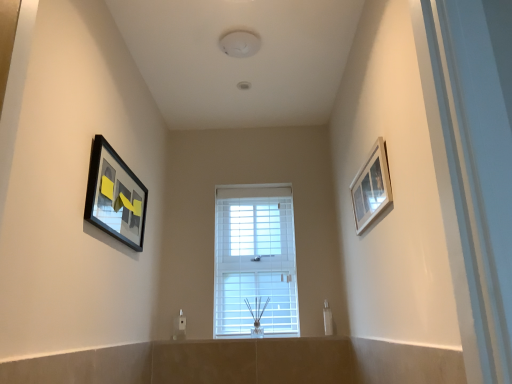
Question: Is point (359, 190) positioned closer to the camera than point (245, 284)?

Choices:
 (A) farther
 (B) closer

Answer: (B)

Question: Considering the positions of white glossy picture frame at upper right, the second picture frame when ordered from left to right, and white matte window at center in the image, is white glossy picture frame at upper right, the second picture frame when ordered from left to right, wider or thinner than white matte window at center?

Choices:
 (A) thin
 (B) wide

Answer: (A)

Question: Estimate the real-world distances between objects in this image. Which object is closer to the white glossy picture frame at upper right, the second picture frame when ordered from left to right?

Choices:
 (A) white matte window at center
 (B) matte black picture frame at left, the second picture frame from the right

Answer: (A)

Question: Which is nearer to the white glossy picture frame at upper right, marked as the 1th picture frame in a right-to-left arrangement?

Choices:
 (A) white matte window at center
 (B) matte black picture frame at left, the second picture frame from the right

Answer: (A)